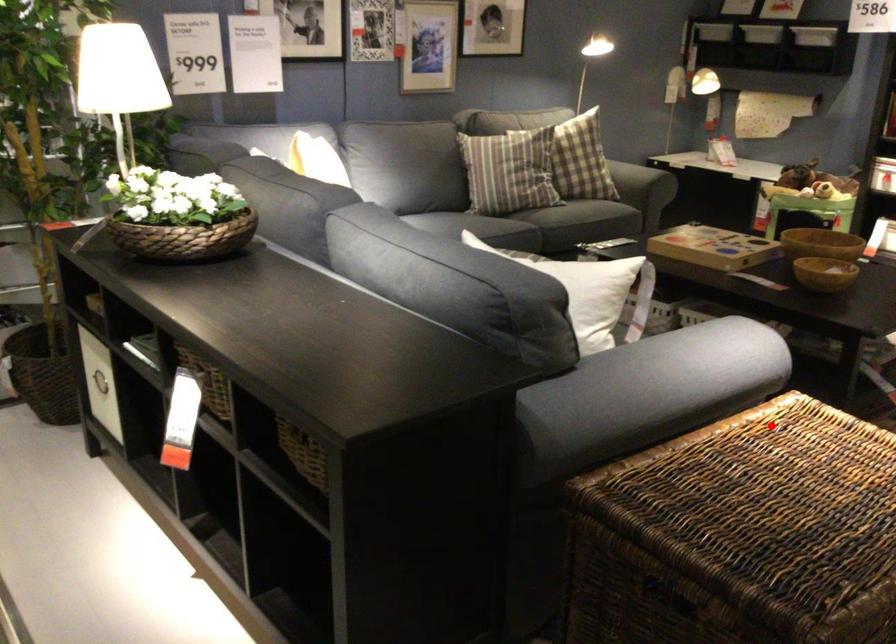
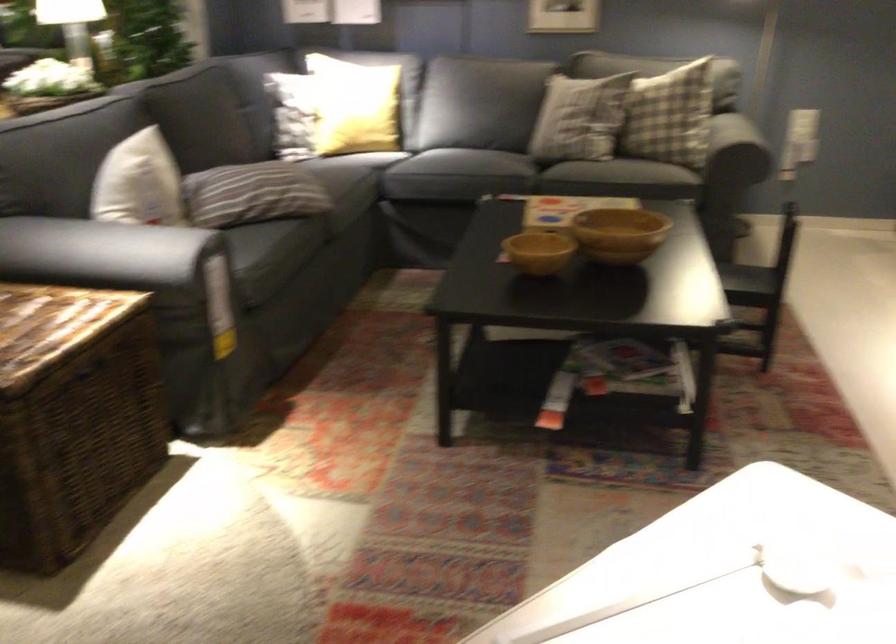
Find the pixel in the second image that matches the highlighted location in the first image.

(55, 317)